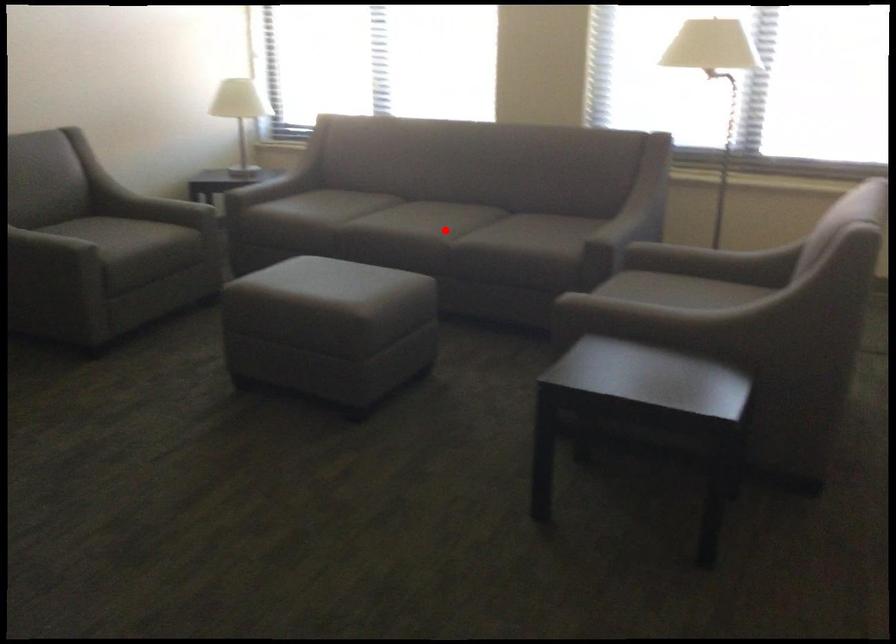
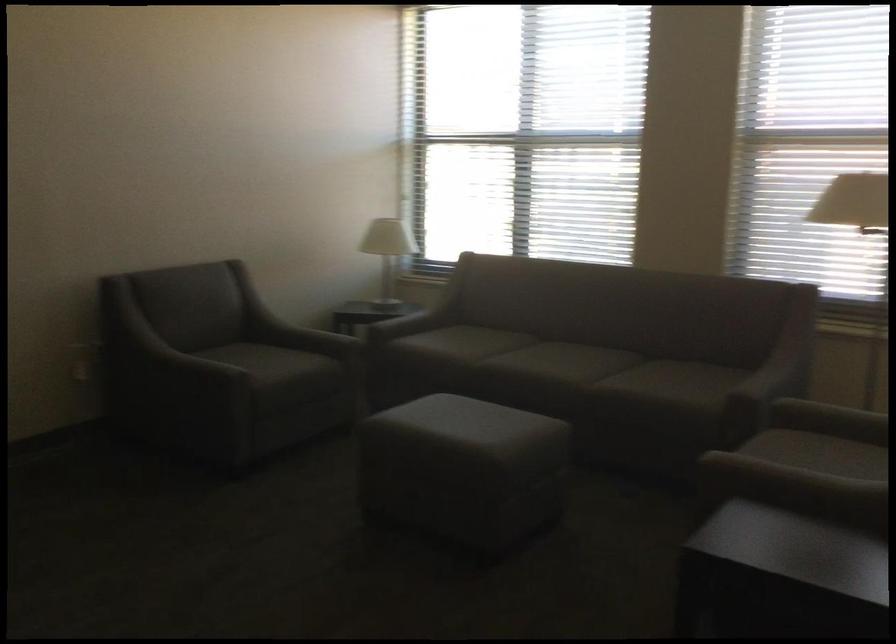
Where in the second image is the point corresponding to the highlighted location from the first image?

(580, 373)